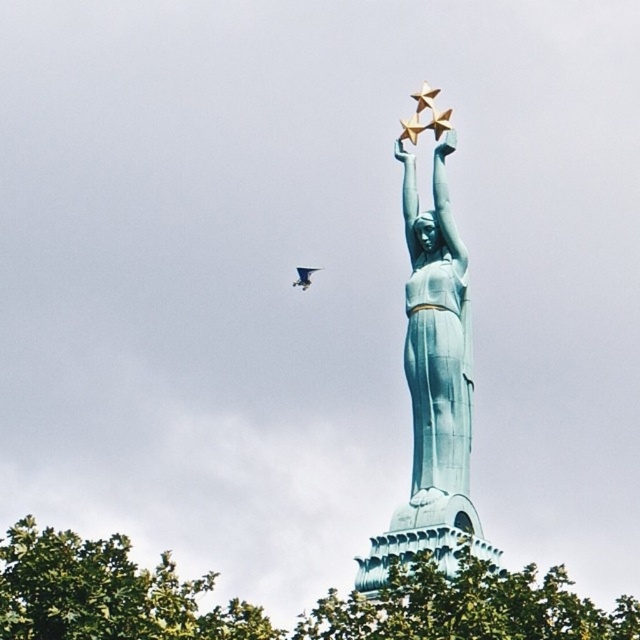
You are a gardener who needs to water the green leafy tree at center and the green leafy tree at lower left. Which tree is located more to the left?

The green leafy tree at lower left is positioned more to the left than the green leafy tree at center.

You are standing in front of the statue and want to walk towards the green leafy tree at center and the green leafy tree at lower left. Which tree will you reach first?

The green leafy tree at center is closer to you, so you will reach it first because it is further to the viewer than the green leafy tree at lower left.

You are a landscape architect designing a garden path that needs to pass between the green leafy tree at center and the green leafy tree at lower left. Which tree should you consider for pruning to ensure the path is wide enough for two people to walk side by side?

The green leafy tree at center occupies less space than the green leafy tree at lower left, so you should consider pruning the green leafy tree at lower left to ensure the path is wide enough for two people to walk side by side.